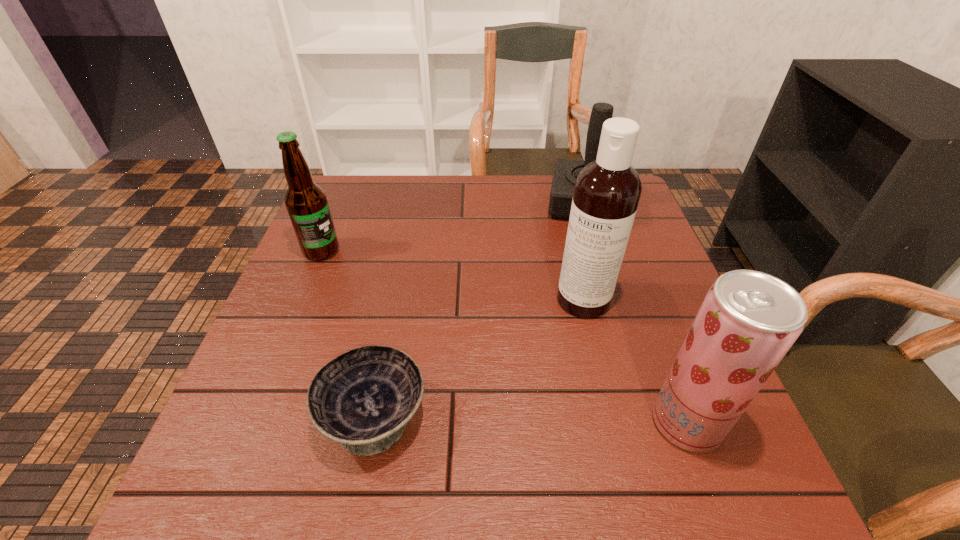
Locate an element on the screen. The image size is (960, 540). free space on the desktop that is between the second object from left to right and the fruit juice and is positioned on the label side of the third nearest object is located at coordinates (530, 419).

Where is `free spot on the desktop that is between the bowl and the fruit juice and is positioned on the base of the farthest object`? This screenshot has width=960, height=540. free spot on the desktop that is between the bowl and the fruit juice and is positioned on the base of the farthest object is located at coordinates coord(576,420).

Identify the location of vacant space on the desktop that is between the shortest object and the fruit juice and is positioned on the label of the second farthest object. (543, 420).